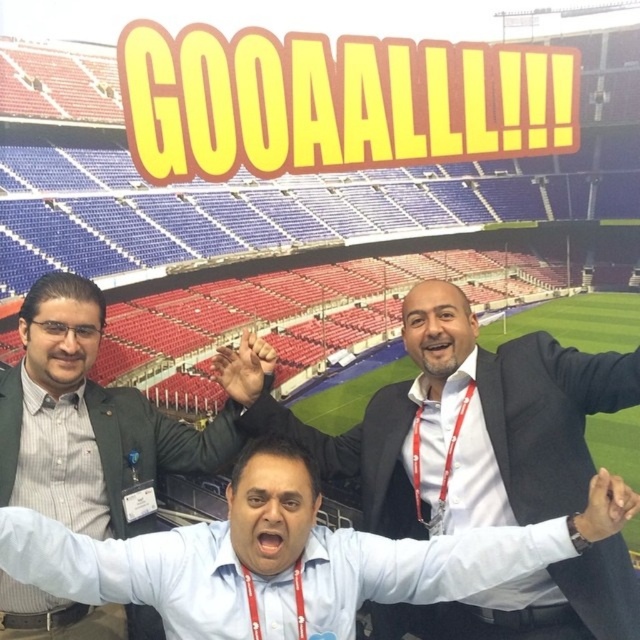
You are a photographer standing at the back of the stadium. You want to take a photo of both the blue shirt at center and the matte black jacket at upper left. Which object will appear smaller in your photo?

The blue shirt at center will appear smaller in the photo because it has a lesser height compared to the matte black jacket at upper left.

You are a photographer positioned at the back of the stadium. You need to take a photo that includes both the white glossy shirt at center and the matte black jacket at upper left. Based on their positions, which object should you adjust your camera to focus on first to ensure both are in frame?

The white glossy shirt at center is to the right of the matte black jacket at upper left. To include both in the frame, focus on the matte black jacket at upper left first since it is on the left side, then adjust the camera to include the white glossy shirt at center on the right.

You are a photographer positioned at the bottom left corner of the stadium. You want to take a photo of the white glossy shirt at center. Which direction should you move to get the best shot?

The white glossy shirt at center is located at coordinates approximately 0.661 on the horizontal axis and 0.719 on the vertical axis. Since you are at the bottom left corner, moving towards the right and slightly upwards would align you with the shirt for the best shot.